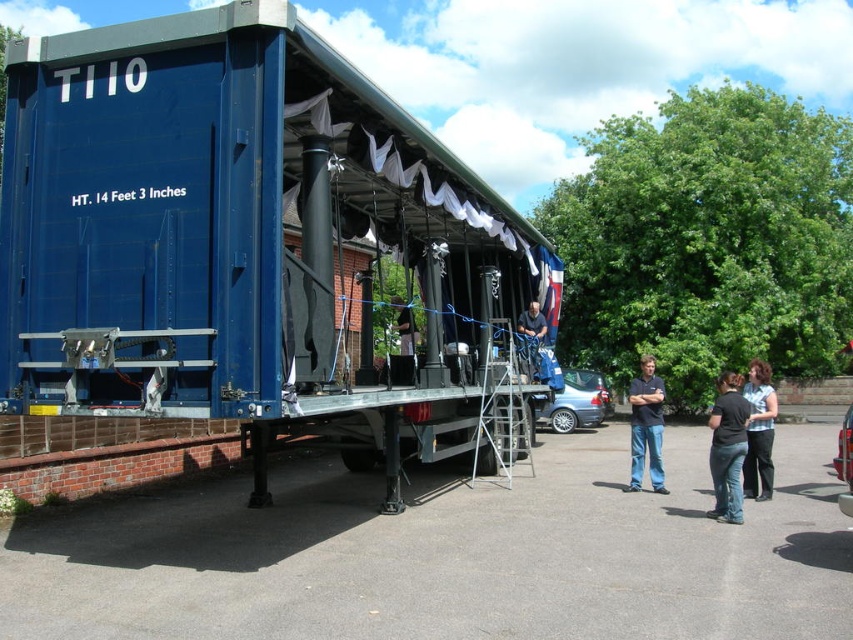
Question: Which object appears farthest from the camera in this image?

Choices:
 (A) dark blue fabric at center
 (B) black fabric at center

Answer: (A)

Question: Where is blue matte trailer truck at center located in relation to black fabric at center in the image?

Choices:
 (A) right
 (B) left

Answer: (B)

Question: Is black jeans at lower right bigger than dark blue jeans at center?

Choices:
 (A) no
 (B) yes

Answer: (B)

Question: Can you confirm if blue matte trailer truck at center is bigger than black jeans at lower right?

Choices:
 (A) yes
 (B) no

Answer: (A)

Question: Among these objects, which one is farthest from the camera?

Choices:
 (A) black jeans at lower right
 (B) dark blue jeans at center

Answer: (B)

Question: Estimate the real-world distances between objects in this image. Which object is closer to the black jeans at lower right?

Choices:
 (A) dark blue fabric at center
 (B) blue matte trailer truck at center
 (C) dark blue jeans at center

Answer: (C)